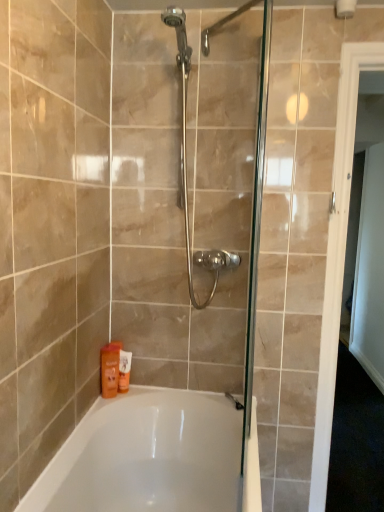
Question: Considering the relative sizes of white glossy door at right and orange matte lotion at lower left, the first toiletry viewed from the back, in the image provided, is white glossy door at right bigger than orange matte lotion at lower left, the first toiletry viewed from the back,?

Choices:
 (A) yes
 (B) no

Answer: (A)

Question: Is the position of white glossy door at right more distant than that of orange matte lotion at lower left, the first toiletry viewed from the back?

Choices:
 (A) no
 (B) yes

Answer: (A)

Question: Is white glossy door at right not close to orange matte lotion at lower left, the first toiletry viewed from the back?

Choices:
 (A) no
 (B) yes

Answer: (B)

Question: Is white glossy door at right at the left side of orange matte lotion at lower left, the first toiletry viewed from the back?

Choices:
 (A) no
 (B) yes

Answer: (A)

Question: Can you confirm if white glossy door at right is wider than orange matte lotion at lower left, the first toiletry viewed from the back?

Choices:
 (A) no
 (B) yes

Answer: (B)

Question: From a real-world perspective, is white glossy door at right positioned under orange matte lotion at lower left, the first toiletry viewed from the back, based on gravity?

Choices:
 (A) yes
 (B) no

Answer: (B)

Question: From a real-world perspective, is orange matte bottle at lower left, which is counted as the first toiletry, starting from the front, physically below white glossy door at right?

Choices:
 (A) no
 (B) yes

Answer: (B)

Question: Can you confirm if orange matte bottle at lower left, which ranks as the second toiletry in back-to-front order, is taller than white glossy door at right?

Choices:
 (A) yes
 (B) no

Answer: (B)

Question: Considering the relative positions of orange matte bottle at lower left, which ranks as the second toiletry in back-to-front order, and white glossy door at right in the image provided, is orange matte bottle at lower left, which ranks as the second toiletry in back-to-front order, in front of white glossy door at right?

Choices:
 (A) no
 (B) yes

Answer: (A)

Question: From the image's perspective, is orange matte bottle at lower left, which is counted as the first toiletry, starting from the front, over white glossy door at right?

Choices:
 (A) yes
 (B) no

Answer: (B)

Question: Could you tell me if orange matte bottle at lower left, which ranks as the second toiletry in back-to-front order, is facing white glossy door at right?

Choices:
 (A) yes
 (B) no

Answer: (B)

Question: Is orange matte bottle at lower left, which is counted as the first toiletry, starting from the front, outside of white glossy door at right?

Choices:
 (A) no
 (B) yes

Answer: (B)

Question: Is white glossy door at right smaller than orange matte bottle at lower left, which ranks as the second toiletry in back-to-front order?

Choices:
 (A) yes
 (B) no

Answer: (B)